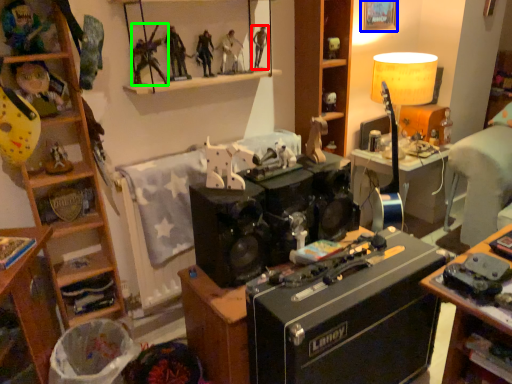
Question: Estimate the real-world distances between objects in this image. Which object is farther from person (highlighted by a red box), picture frame (highlighted by a blue box) or person (highlighted by a green box)?

Choices:
 (A) picture frame
 (B) person

Answer: (A)